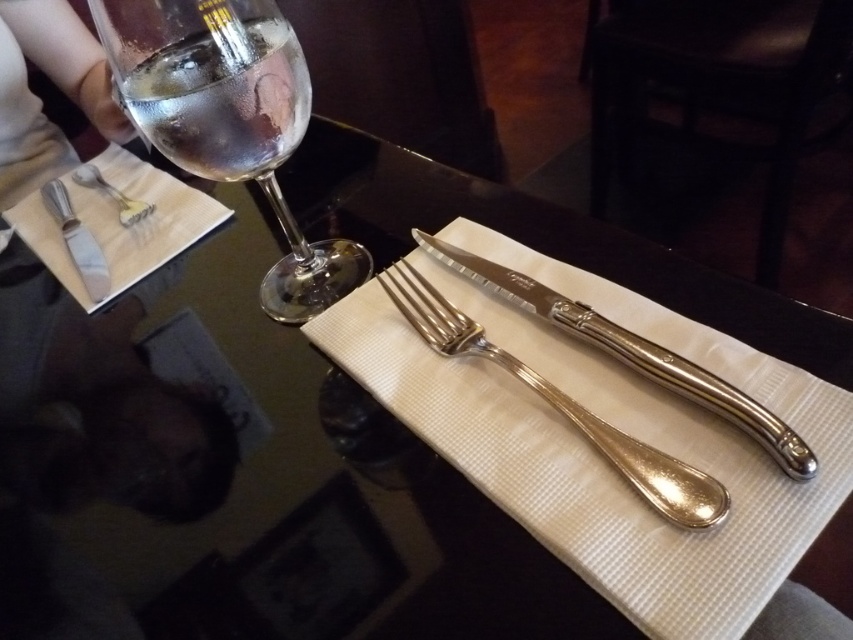
You are a waiter who needs to place a 30 cm long decorative ribbon from the camera position to the clear glass wine glass at upper left. Can you fit the ribbon without it hanging off the table?

The distance of clear glass wine glass at upper left from camera is 36.27 centimeters, so the 30 cm ribbon can be placed from the camera position to the glass without hanging off since it is shorter than the distance.

You are a waiter at a restaurant and need to place a new wine glass on the table. The existing clear glass wine glass at upper left is located at coordinate point 0.186, 0.268. If you want to place the new glass 2 inches to the right of the existing one, what coordinate point should you aim for?

The new wine glass should be placed at coordinate point 0.186 plus 2 inches divided by the table length in the x direction, but since the coordinate system is normalized between 0 and 1, adding 0.02 to the x coordinate would place it 2 inches to the right. Therefore, the new coordinate point would be approximately (228,131).